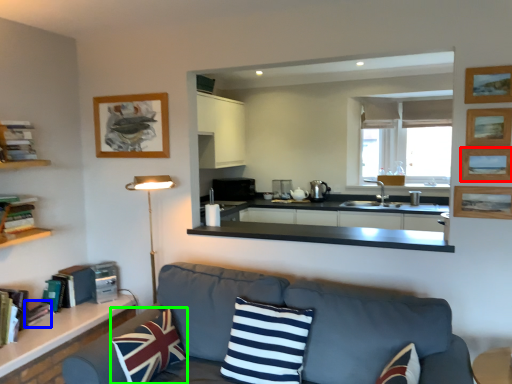
Question: Which object is positioned closest to picture frame (highlighted by a red box)? Select from book (highlighted by a blue box) and pillow (highlighted by a green box).

Choices:
 (A) book
 (B) pillow

Answer: (B)